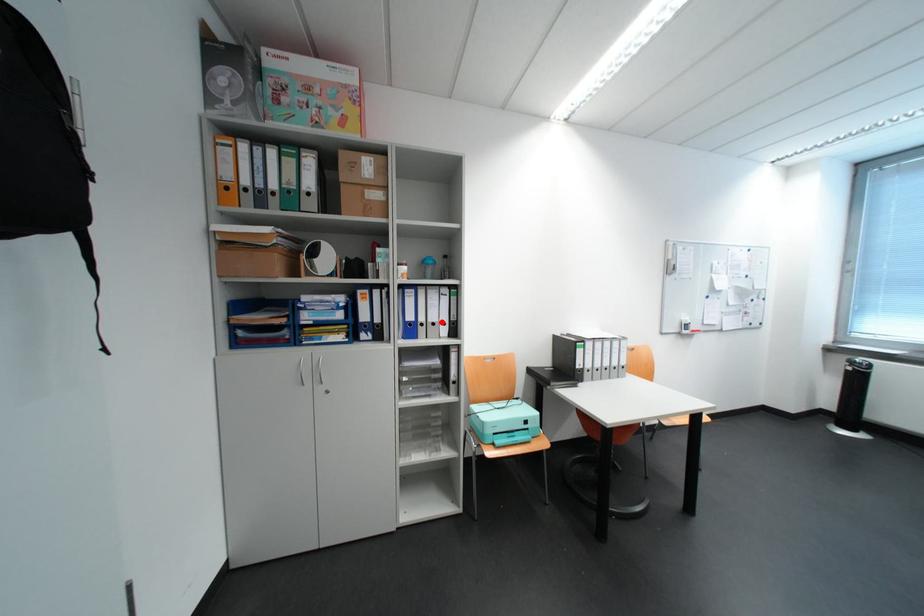
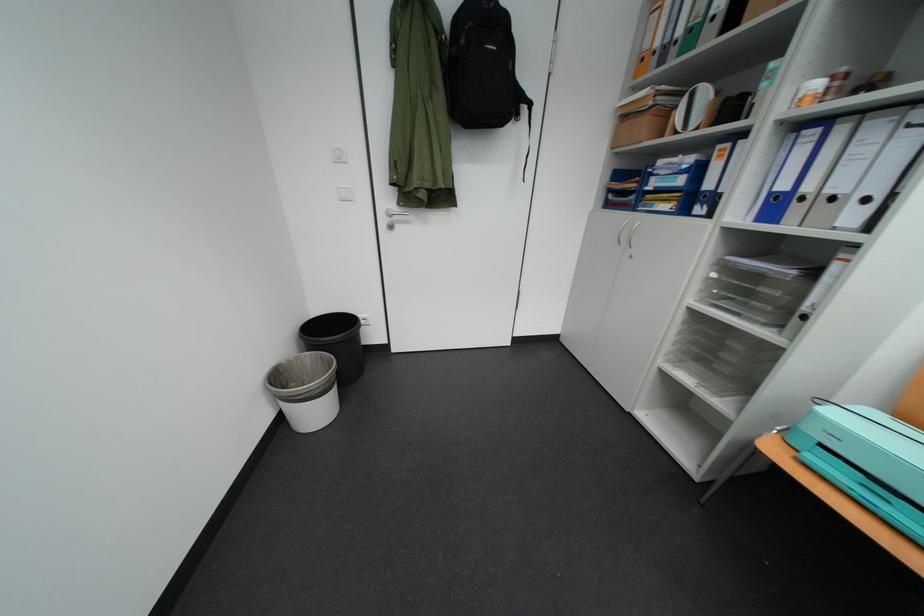
Where in the second image is the point corresponding to the highlighted location from the first image?

(841, 193)